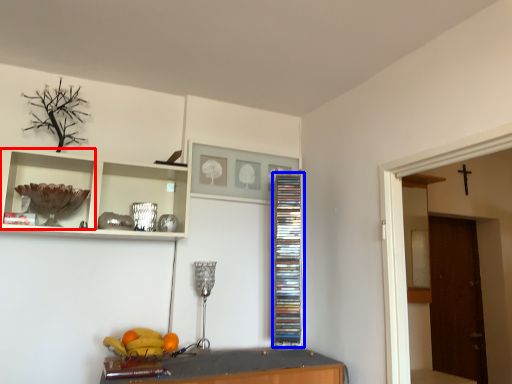
Question: Which object appears farthest to the camera in this image, cabinet (highlighted by a red box) or cabinet (highlighted by a blue box)?

Choices:
 (A) cabinet
 (B) cabinet

Answer: (B)